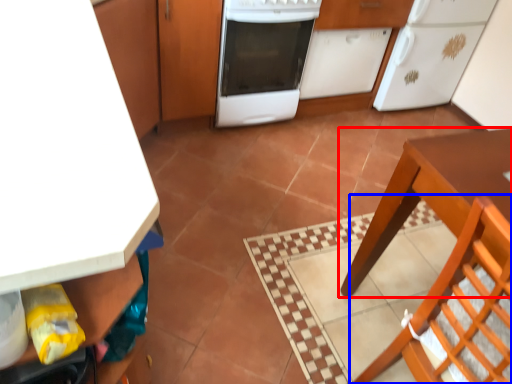
Question: Which point is closer to the camera, table (highlighted by a red box) or chair (highlighted by a blue box)?

Choices:
 (A) table
 (B) chair

Answer: (B)